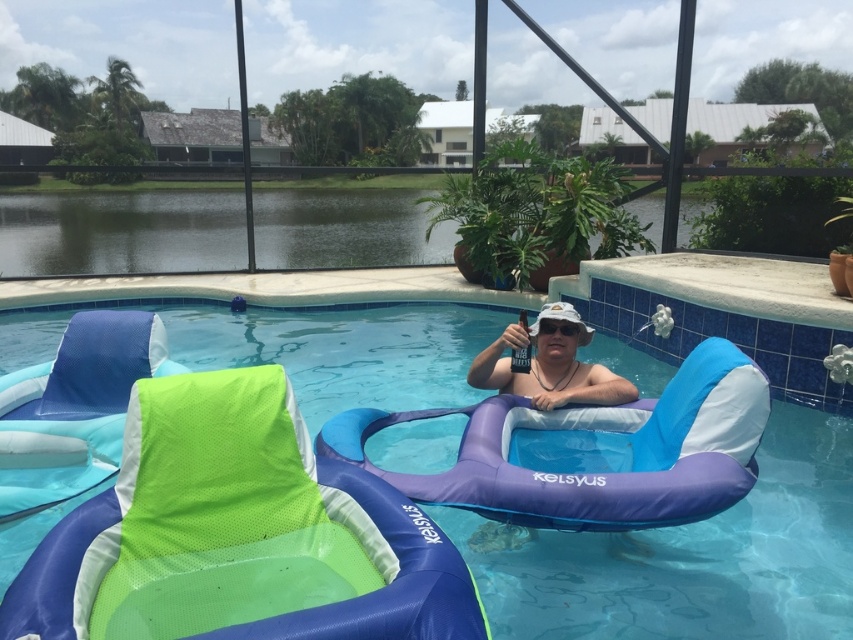
Question: Does blue inflatable float at center have a larger size compared to white matte goggles at center?

Choices:
 (A) no
 (B) yes

Answer: (B)

Question: Considering the relative positions of blue inflatable float at center and white matte goggles at center in the image provided, where is blue inflatable float at center located with respect to white matte goggles at center?

Choices:
 (A) above
 (B) below

Answer: (B)

Question: Among these objects, which one is farthest from the camera?

Choices:
 (A) white matte goggles at center
 (B) blue inflatable float at center

Answer: (A)

Question: Can you confirm if blue inflatable float at center is bigger than white matte goggles at center?

Choices:
 (A) yes
 (B) no

Answer: (A)